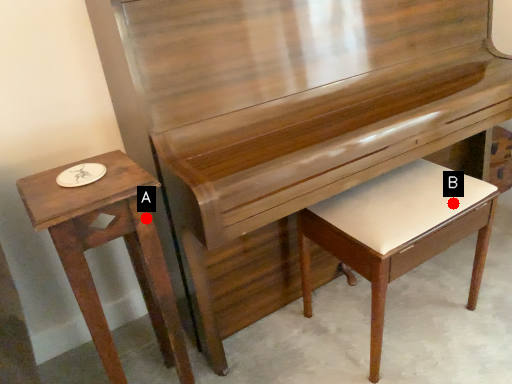
Question: Two points are circled on the image, labeled by A and B beside each circle. Which point appears closest to the camera in this image?

Choices:
 (A) A is closer
 (B) B is closer

Answer: (A)